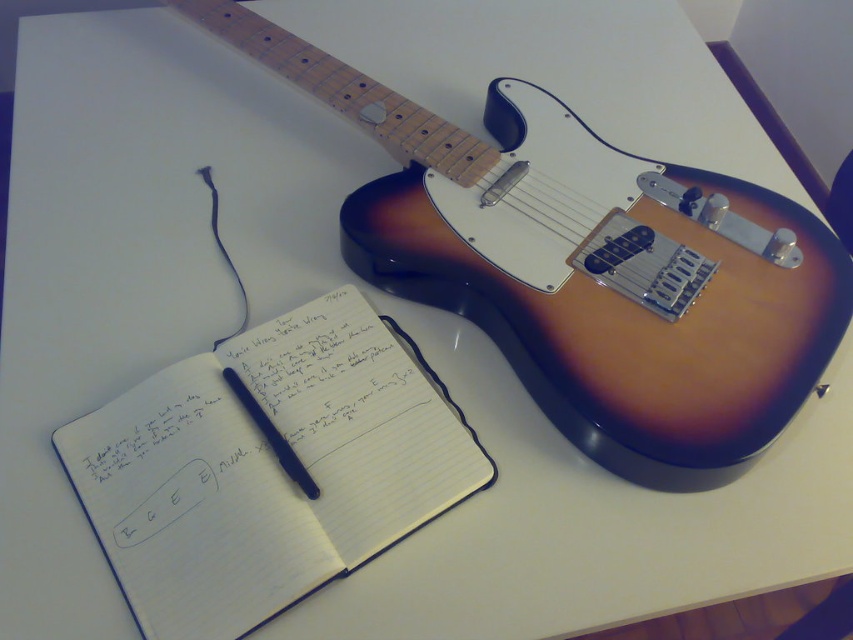
You are a photographer standing at a distance of 1.2 meters from the camera position. You want to take a photo of the sunburst electric guitar and ensure that the point at coordinates point (514, 212) is in focus. Can you adjust your position so that you are exactly at the same distance as the point to get it sharp?

The point point (514, 212) is 1.15 meters away from the camera. Since you are standing 1.2 meters away, which is slightly farther, you need to move 0.05 meters closer to match the point (514, 212) distance for optimal focus.

From the picture: You are a musician trying to place a new sticker on your satin wood guitar at upper right. You have a sticker that is the same size as the matte black pen at center. Will the sticker fit on the guitar?

The satin wood guitar at upper right is much taller than the matte black pen at center, so the sticker, which is the same size as the pen, will fit on the guitar.

You are a musician who needs to place both the satin wood guitar at upper right and the matte black pen at center into a storage case. The case has a compartment that can only fit items up to the size of the pen. Which item will not fit in the compartment?

The satin wood guitar at upper right will not fit in the compartment because its width is larger than the matte black pen at center, which is the maximum size allowed.